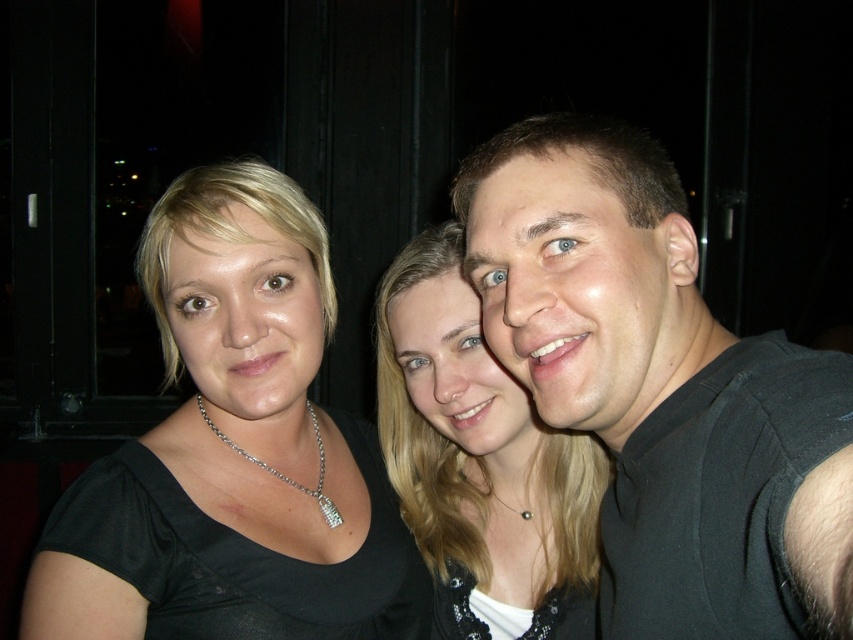
Question: Is black satin top at left wider than silver/diamond necklace at center?

Choices:
 (A) no
 (B) yes

Answer: (B)

Question: Among these points, which one is farthest from the camera?

Choices:
 (A) (186, 360)
 (B) (328, 516)
 (C) (465, 257)
 (D) (485, 429)

Answer: (D)

Question: Is black matte shirt at right to the right of smooth blonde hair at center from the viewer's perspective?

Choices:
 (A) no
 (B) yes

Answer: (B)

Question: Which object is the closest to the black matte shirt at right?

Choices:
 (A) smooth blonde hair at center
 (B) silver/diamond necklace at center
 (C) black satin top at left

Answer: (A)

Question: Observing the image, what is the correct spatial positioning of black satin top at left in reference to smooth blonde hair at center?

Choices:
 (A) left
 (B) right

Answer: (A)

Question: Which of the following is the closest to the observer?

Choices:
 (A) (640, 525)
 (B) (202, 416)
 (C) (280, 540)

Answer: (A)